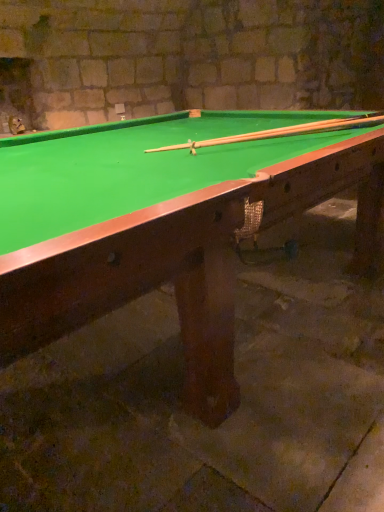
The image size is (384, 512). What do you see at coordinates (278, 133) in the screenshot?
I see `wooden cue at center` at bounding box center [278, 133].

Locate an element on the screen. wooden cue at center is located at coordinates (278, 133).

Describe the element at coordinates (168, 222) in the screenshot. I see `green felt billiard table at center` at that location.

This screenshot has width=384, height=512. Identify the location of green felt billiard table at center. (168, 222).

Locate an element on the screen. Image resolution: width=384 pixels, height=512 pixels. wooden cue at center is located at coordinates (278, 133).

Which is more to the left, green felt billiard table at center or wooden cue at center?

From the viewer's perspective, green felt billiard table at center appears more on the left side.

Is green felt billiard table at center behind wooden cue at center?

That is False.

Is point (288, 197) more distant than point (210, 146)?

No, it is not.

From the image's perspective, is green felt billiard table at center over wooden cue at center?

No, from the image's perspective, green felt billiard table at center is not on top of wooden cue at center.

From a real-world perspective, is green felt billiard table at center under wooden cue at center?

Indeed, from a real-world perspective, green felt billiard table at center is positioned beneath wooden cue at center.

Can you confirm if green felt billiard table at center is wider than wooden cue at center?

Yes.

Can you confirm if green felt billiard table at center is taller than wooden cue at center?

Indeed, green felt billiard table at center has a greater height compared to wooden cue at center.

Does green felt billiard table at center have a larger size compared to wooden cue at center?

Correct, green felt billiard table at center is larger in size than wooden cue at center.

Is green felt billiard table at center inside or outside of wooden cue at center?

green felt billiard table at center is not inside wooden cue at center, it's outside.

Is green felt billiard table at center next to wooden cue at center and touching it?

No, green felt billiard table at center is not touching wooden cue at center.

Consider the image. Is green felt billiard table at center facing away from wooden cue at center?

green felt billiard table at center does not have its back to wooden cue at center.

What's the angular difference between green felt billiard table at center and wooden cue at center's facing directions?

The angle between the facing direction of green felt billiard table at center and the facing direction of wooden cue at center is 60.3 degrees.

Looking at this image, how much distance is there between green felt billiard table at center and wooden cue at center?

The distance of green felt billiard table at center from wooden cue at center is 15.04 inches.

Where is `cue positioned vertically above the green felt billiard table at center (from a real-world perspective)`? The width and height of the screenshot is (384, 512). cue positioned vertically above the green felt billiard table at center (from a real-world perspective) is located at coordinates (278, 133).

Based on their positions, is wooden cue at center located to the left or right of green felt billiard table at center?

From the image, it's evident that wooden cue at center is to the right of green felt billiard table at center.

Is the position of wooden cue at center less distant than that of green felt billiard table at center?

No, the depth of wooden cue at center is greater than that of green felt billiard table at center.

Does point (256, 132) come closer to viewer compared to point (206, 293)?

No.

From the image's perspective, would you say wooden cue at center is positioned over green felt billiard table at center?

Yes, from the image's perspective, wooden cue at center is on top of green felt billiard table at center.

From a real-world perspective, is wooden cue at center positioned above or below green felt billiard table at center?

In terms of real-world spatial position, wooden cue at center is above green felt billiard table at center.

Considering the sizes of objects wooden cue at center and green felt billiard table at center in the image provided, who is thinner, wooden cue at center or green felt billiard table at center?

wooden cue at center.

In terms of height, does wooden cue at center look taller or shorter compared to green felt billiard table at center?

wooden cue at center is shorter than green felt billiard table at center.

Between wooden cue at center and green felt billiard table at center, which one has larger size?

With larger size is green felt billiard table at center.

Which is correct: wooden cue at center is inside green felt billiard table at center, or outside of it?

wooden cue at center fits inside green felt billiard table at center.

Is wooden cue at center touching green felt billiard table at center?

No, wooden cue at center is not with green felt billiard table at center.

Is green felt billiard table at center at the back of wooden cue at center?

Yes.

Locate an element on the screen. The width and height of the screenshot is (384, 512). billiard table on the left of wooden cue at center is located at coordinates (168, 222).

The image size is (384, 512). In order to click on billiard table on the left of wooden cue at center in this screenshot , I will do `click(168, 222)`.

In the image, there is a wooden cue at center. Where is `billiard table below it (from the image's perspective)`? billiard table below it (from the image's perspective) is located at coordinates (168, 222).